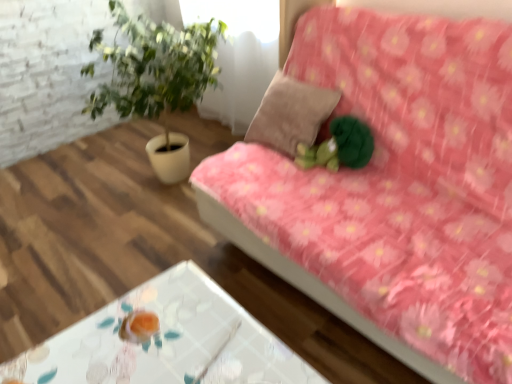
At what (x,y) coordinates should I click in order to perform the action: click on blank space situated above transparent glass table at lower center (from a real-world perspective). Please return your answer as a coordinate pair (x, y). This screenshot has width=512, height=384. Looking at the image, I should click on (156, 341).